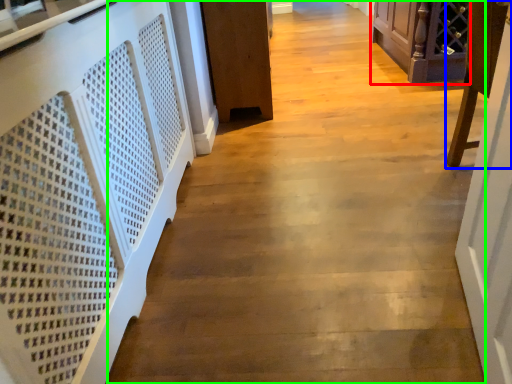
Question: Which object is positioned closest to furniture (highlighted by a red box)? Select from furniture (highlighted by a blue box) and path (highlighted by a green box).

Choices:
 (A) furniture
 (B) path

Answer: (B)